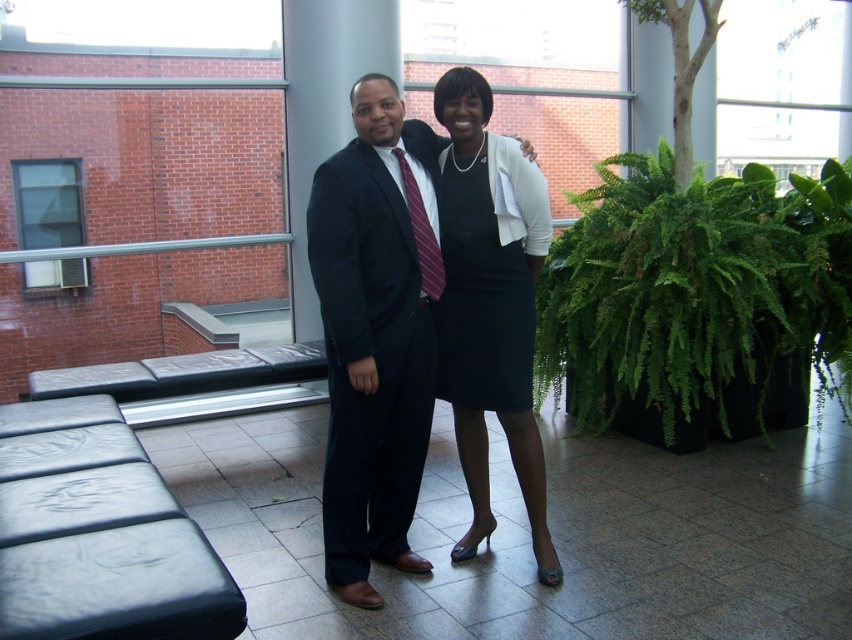
Does green leafy plant at right have a smaller size compared to dark blue wool suit at center?

Actually, green leafy plant at right might be larger than dark blue wool suit at center.

Looking at this image, does green leafy plant at right appear on the right side of dark blue wool suit at center?

Yes, green leafy plant at right is to the right of dark blue wool suit at center.

Does point (570, 246) lie in front of point (373, 496)?

No.

This screenshot has height=640, width=852. I want to click on green leafy plant at right, so click(692, 291).

Does matte black suit at center appear on the right side of matte black dress at center?

Incorrect, matte black suit at center is not on the right side of matte black dress at center.

Does matte black suit at center have a lesser height compared to matte black dress at center?

Yes, matte black suit at center is shorter than matte black dress at center.

Between point (373, 376) and point (527, 476), which one is positioned behind?

The point (527, 476) is behind.

The height and width of the screenshot is (640, 852). In order to click on matte black suit at center in this screenshot , I will do `click(375, 332)`.

Who is shorter, matte black suit at center or black satin dress at center?

black satin dress at center

Which is behind, point (419, 218) or point (501, 321)?

The point (501, 321) is behind.

Locate an element on the screen. The image size is (852, 640). matte black suit at center is located at coordinates (375, 332).